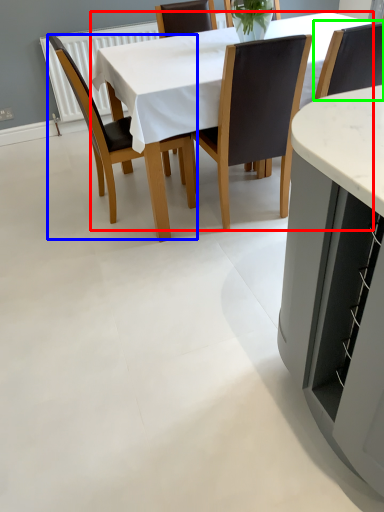
Question: Estimate the real-world distances between objects in this image. Which object is closer to kitchen & dining room table (highlighted by a red box), chair (highlighted by a blue box) or chair (highlighted by a green box)?

Choices:
 (A) chair
 (B) chair

Answer: (A)